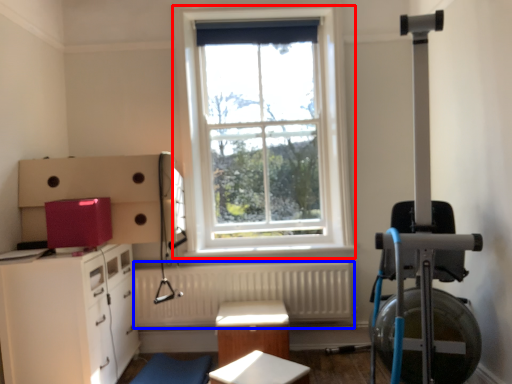
Question: Which of the following is the farthest to the observer, window (highlighted by a red box) or radiator (highlighted by a blue box)?

Choices:
 (A) window
 (B) radiator

Answer: (A)